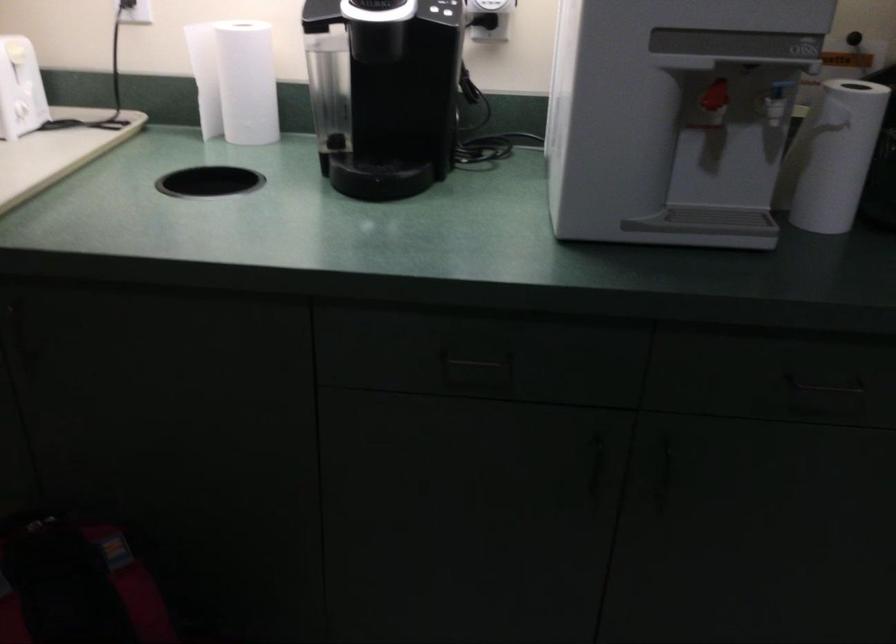
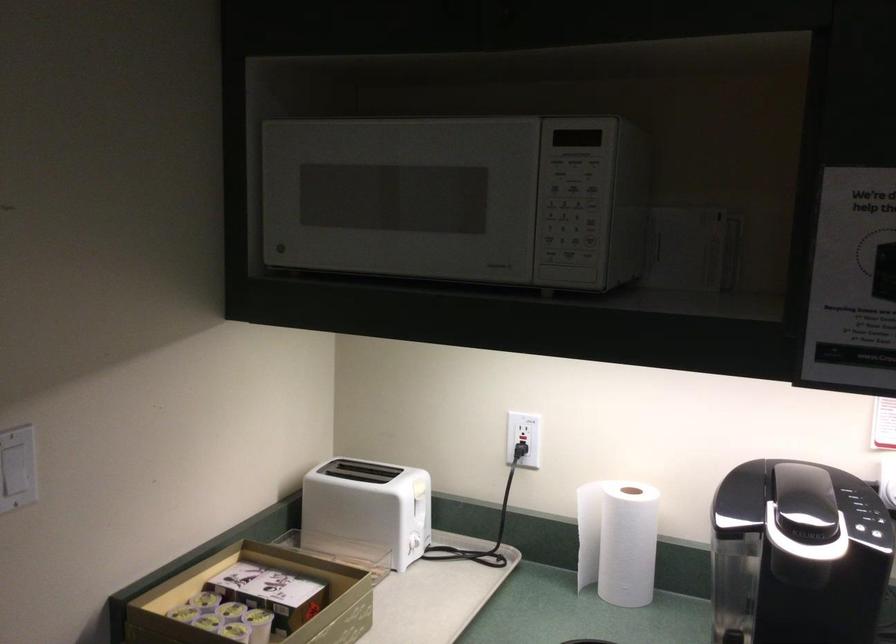
Where in the second image is the point corresponding to (x=231, y=71) from the first image?

(617, 540)